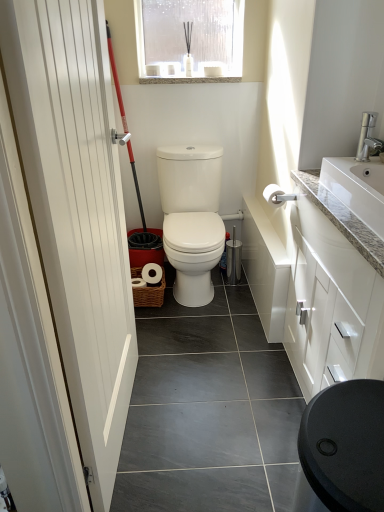
Question: Considering the positions of white matte toilet paper at upper right and white smooth door at left in the image, is white matte toilet paper at upper right taller or shorter than white smooth door at left?

Choices:
 (A) short
 (B) tall

Answer: (A)

Question: In the image, is white matte toilet paper at upper right positioned in front of or behind white smooth door at left?

Choices:
 (A) behind
 (B) front

Answer: (A)

Question: Based on their relative distances, which object is farther from the translucent plastic window at upper center?

Choices:
 (A) white granite sink at upper right
 (B) white matte toilet paper at upper right
 (C) white smooth door at left
 (D) silver metallic faucet at upper right

Answer: (C)

Question: Estimate the real-world distances between objects in this image. Which object is farther from the white smooth door at left?

Choices:
 (A) white matte toilet paper at upper right
 (B) translucent plastic window at upper center
 (C) silver metallic faucet at upper right
 (D) white granite sink at upper right

Answer: (B)